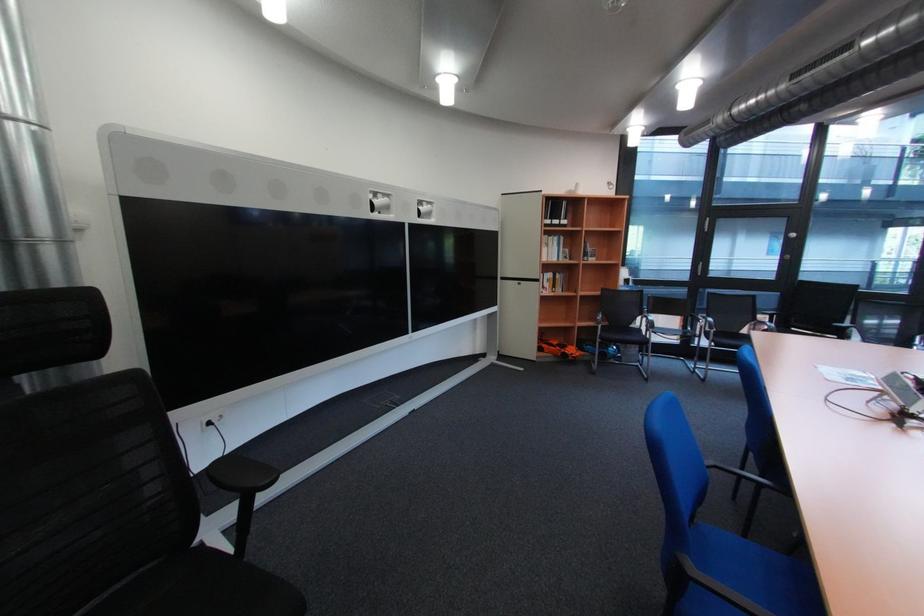
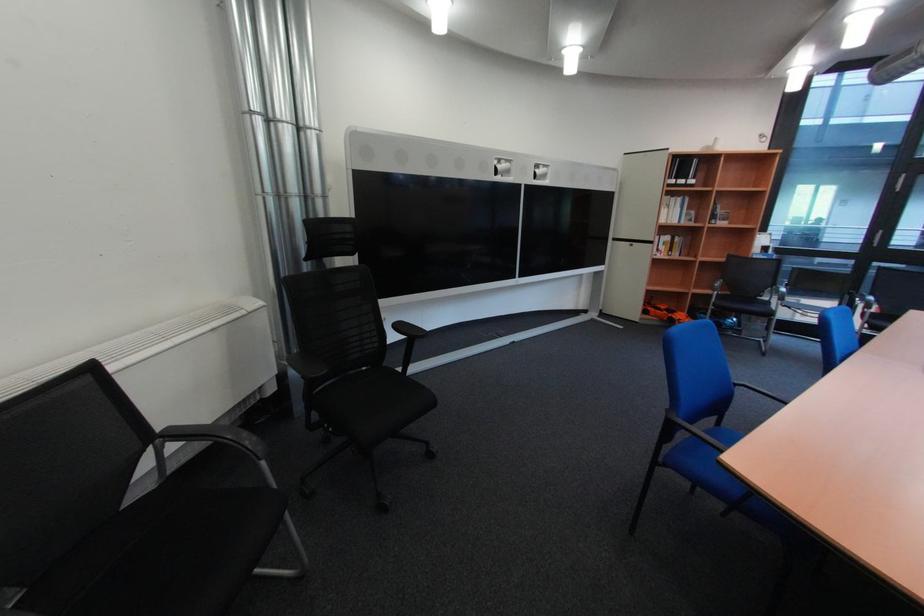
Question: Based on the continuous images, in which direction is the camera rotating? Reply with the corresponding letter.

Choices:
 (A) Left
 (B) Right
 (C) Up
 (D) Down

Answer: (A)